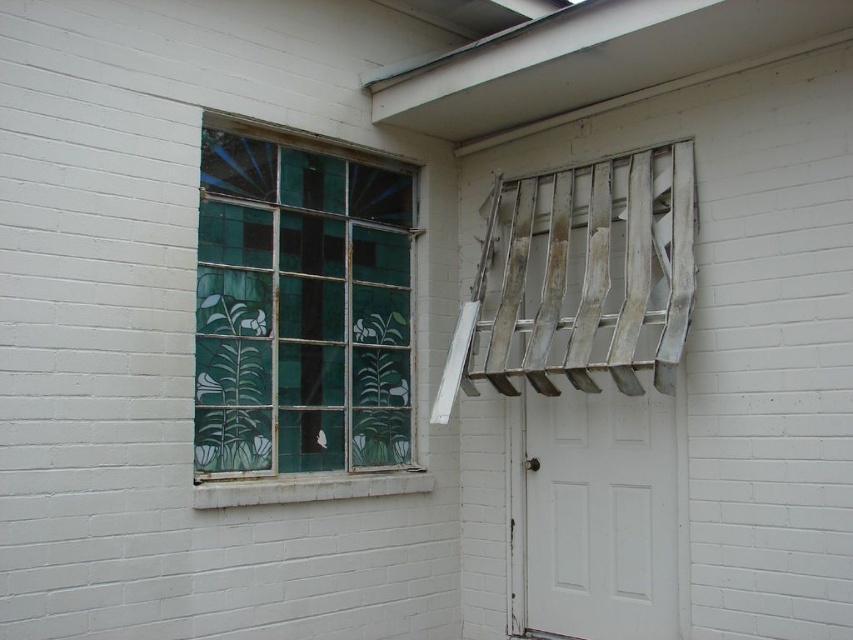
Question: Where is green stained glass window at left located in relation to white matte door at center in the image?

Choices:
 (A) below
 (B) above

Answer: (B)

Question: Which point appears farthest from the camera in this image?

Choices:
 (A) (260, 273)
 (B) (556, 493)

Answer: (B)

Question: Does green stained glass window at left have a greater width compared to white matte door at center?

Choices:
 (A) no
 (B) yes

Answer: (B)

Question: Does green stained glass window at left come in front of white matte door at center?

Choices:
 (A) no
 (B) yes

Answer: (B)